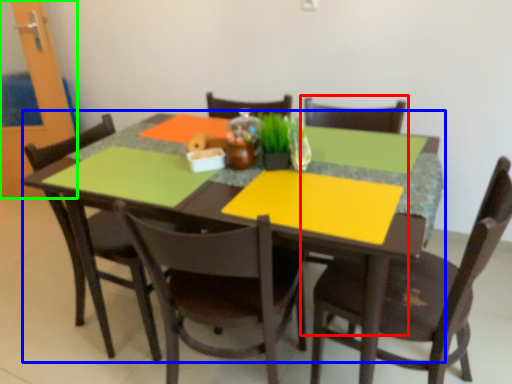
Question: Which object is the farthest from armchair (highlighted by a red box)? Choose among these: kitchen & dining room table (highlighted by a blue box) or glass door (highlighted by a green box).

Choices:
 (A) kitchen & dining room table
 (B) glass door

Answer: (B)